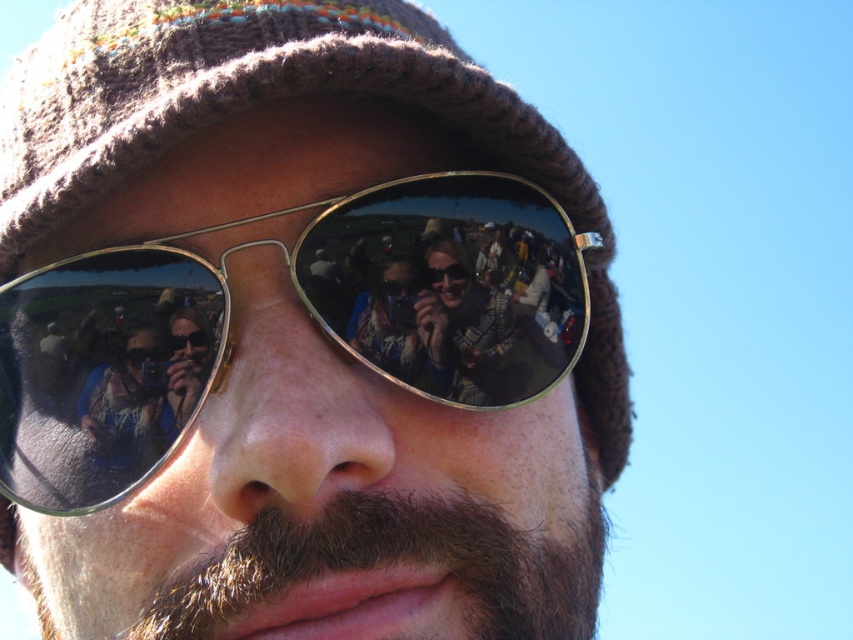
Please provide the exact coordinates of the dark brown fuzzy beard at center in the image. The coordinate system is defined as follows. The origin is at the bottom left corner of the image. The x axis points to the right and the y axis points upward. The coordinate values are normalized between 0 and 1. Please answer with the format of x,y.

The dark brown fuzzy beard at center is located at coordinates (393,563).

In the scene shown: You are standing in front of the person in the image and want to determine the position of two points marked on their sunglasses. The points are labeled as point 1 at coordinates point (146, 360) and point 2 at coordinates point (440, 308). Which point is closer to you?

Point (146, 360) is in front of point (440, 308), so it is closer to you.

You are a photographer trying to focus on the dark brown fuzzy beard at center and the plaid fabric shirt at center in the image. Which object is positioned more to the left?

The dark brown fuzzy beard at center is positioned to the left of the plaid fabric shirt at center, so the dark brown fuzzy beard at center is more to the left.